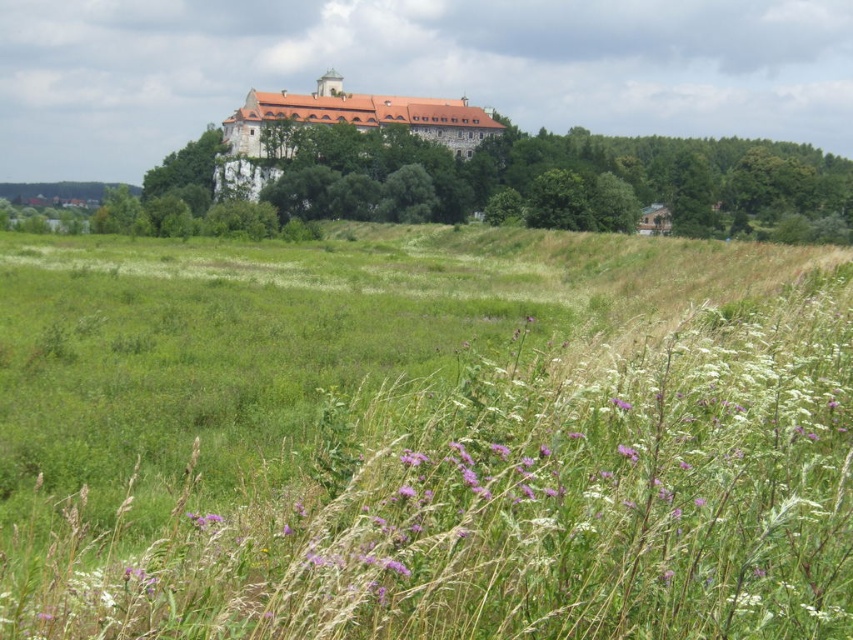
You are an artist planning to paint the landscape. You want to ensure the green leafy tree at upper center and the purple matte flower at center are proportionally accurate. Which object should you draw wider in your painting?

The green leafy tree at upper center should be drawn wider than the purple matte flower at center since its width surpasses the flower.

You are standing in the field of wildflowers and grasses in the foreground of the image. You want to walk towards the brown stone castle at upper center. Which direction should you move relative to the purple matte flower at center?

You should move to the left relative to the purple matte flower at center because the brown stone castle at upper center is located to the left of the purple matte flower at center.

In the scene shown: You are an architect analyzing the image of the brown stone castle at upper center and the green leafy tree at upper center. Which object occupies more horizontal space in the image?

The brown stone castle at upper center occupies more horizontal space than the green leafy tree at upper center because its width is larger.